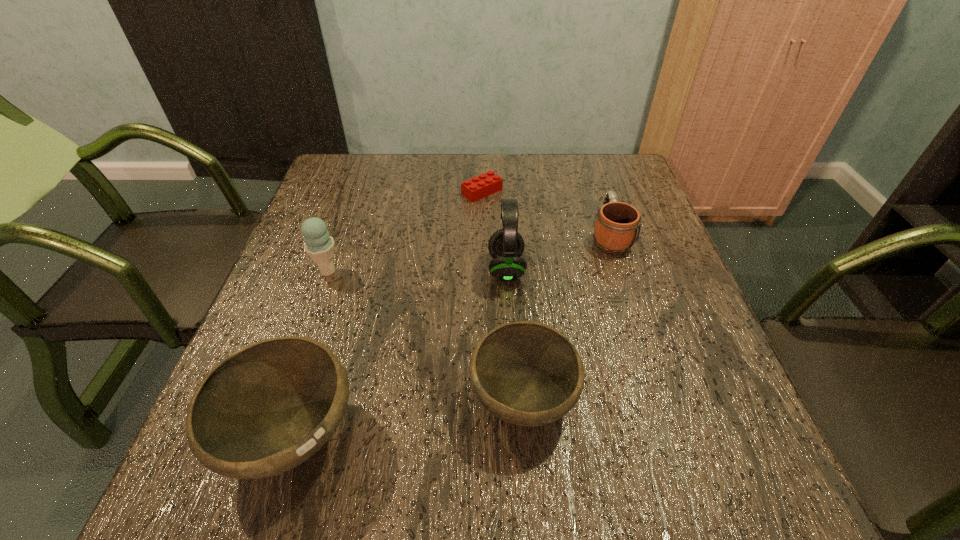
In order to click on blank space located 0.130m on the left of the shorter bowl in this screenshot , I will do `click(396, 400)`.

Find the location of a particular element. free space located 0.070m on the left of the Lego is located at coordinates (436, 192).

In order to click on vacant area located 0.350m on the front of the ice cream in this screenshot , I will do `click(272, 432)`.

You are a GUI agent. You are given a task and a screenshot of the screen. Output one action in this format:
    pyautogui.click(x=<x>, y=<y>)
    Task: Click on the free space located 0.110m on the side of the fifth tallest object with the handle
    Image resolution: width=960 pixels, height=540 pixels.
    Given the screenshot: What is the action you would take?
    pyautogui.click(x=595, y=193)

Locate an element on the screen. vacant space located 0.100m on the side of the fifth tallest object with the handle is located at coordinates (596, 195).

At what (x,y) coordinates should I click in order to perform the action: click on blank space located 0.260m on the side of the fifth tallest object with the handle. Please return your answer as a coordinate pair (x, y). Looking at the image, I should click on (587, 164).

Where is `vacant area situated 0.330m on the ear cups of the tallest object`? This screenshot has height=540, width=960. vacant area situated 0.330m on the ear cups of the tallest object is located at coordinates (344, 268).

This screenshot has height=540, width=960. I want to click on vacant space situated on the ear cups of the tallest object, so click(374, 268).

Image resolution: width=960 pixels, height=540 pixels. I want to click on vacant space located on the ear cups of the tallest object, so click(x=448, y=268).

This screenshot has width=960, height=540. Find the location of `object located in the far edge section of the desktop`. object located in the far edge section of the desktop is located at coordinates (481, 186).